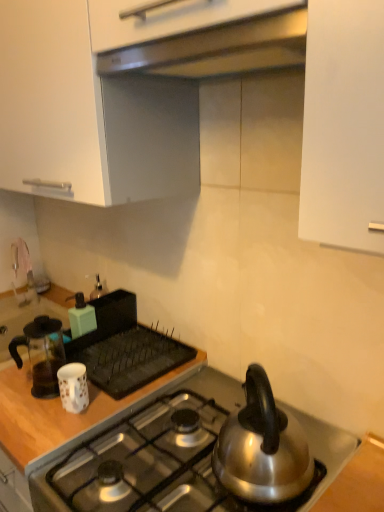
Question: Is polished stainless steel gas stove at lower center bigger than transparent glass coffee pot at left, arranged as the second kitchen appliance when viewed from the back?

Choices:
 (A) yes
 (B) no

Answer: (A)

Question: Does polished stainless steel gas stove at lower center come in front of transparent glass coffee pot at left, the 2th kitchen appliance in the front-to-back sequence?

Choices:
 (A) no
 (B) yes

Answer: (B)

Question: Considering the relative sizes of polished stainless steel gas stove at lower center and transparent glass coffee pot at left, the 2th kitchen appliance in the front-to-back sequence, in the image provided, is polished stainless steel gas stove at lower center smaller than transparent glass coffee pot at left, the 2th kitchen appliance in the front-to-back sequence,?

Choices:
 (A) yes
 (B) no

Answer: (B)

Question: From the image's perspective, is polished stainless steel gas stove at lower center under transparent glass coffee pot at left, the 2th kitchen appliance in the front-to-back sequence?

Choices:
 (A) no
 (B) yes

Answer: (B)

Question: Would you say polished stainless steel gas stove at lower center contains transparent glass coffee pot at left, the 2th kitchen appliance in the front-to-back sequence?

Choices:
 (A) no
 (B) yes

Answer: (A)

Question: From a real-world perspective, is polished stainless steel gas stove at lower center positioned under transparent glass coffee pot at left, the 2th kitchen appliance in the front-to-back sequence, based on gravity?

Choices:
 (A) no
 (B) yes

Answer: (B)

Question: Is matte green soap dispenser at upper left, which ranks as the 1th kitchen appliance in back-to-front order, not within polished stainless steel gas stove at lower center?

Choices:
 (A) no
 (B) yes

Answer: (B)

Question: From the image's perspective, is matte green soap dispenser at upper left, arranged as the 3th kitchen appliance when viewed from the front, located above polished stainless steel gas stove at lower center?

Choices:
 (A) no
 (B) yes

Answer: (B)

Question: Is matte green soap dispenser at upper left, arranged as the 3th kitchen appliance when viewed from the front, shorter than polished stainless steel gas stove at lower center?

Choices:
 (A) yes
 (B) no

Answer: (A)

Question: Can you confirm if matte green soap dispenser at upper left, which ranks as the 1th kitchen appliance in back-to-front order, is bigger than polished stainless steel gas stove at lower center?

Choices:
 (A) no
 (B) yes

Answer: (A)

Question: From the image's perspective, is matte green soap dispenser at upper left, which ranks as the 1th kitchen appliance in back-to-front order, under polished stainless steel gas stove at lower center?

Choices:
 (A) no
 (B) yes

Answer: (A)

Question: Is matte green soap dispenser at upper left, arranged as the 3th kitchen appliance when viewed from the front, facing towards polished stainless steel gas stove at lower center?

Choices:
 (A) no
 (B) yes

Answer: (A)

Question: From the image's perspective, does transparent glass coffee pot at left, arranged as the second kitchen appliance when viewed from the back, appear higher than satin silver exhaust hood at upper center?

Choices:
 (A) yes
 (B) no

Answer: (B)